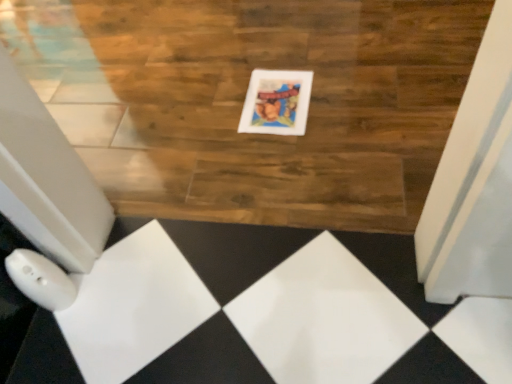
Image resolution: width=512 pixels, height=384 pixels. What do you see at coordinates (244, 99) in the screenshot?
I see `wooden floor at center` at bounding box center [244, 99].

At what (x,y) coordinates should I click in order to perform the action: click on wooden floor at center. Please return your answer as a coordinate pair (x, y). The height and width of the screenshot is (384, 512). Looking at the image, I should click on (244, 99).

The width and height of the screenshot is (512, 384). What do you see at coordinates (276, 102) in the screenshot?
I see `white glossy picture frame at center` at bounding box center [276, 102].

Measure the distance between white glossy picture frame at center and camera.

white glossy picture frame at center and camera are 1.33 meters apart from each other.

Identify the location of white glossy picture frame at center. (276, 102).

This screenshot has height=384, width=512. What are the coordinates of `wooden floor at center` in the screenshot? It's located at (244, 99).

Is wooden floor at center at the left side of white glossy picture frame at center?

Indeed, wooden floor at center is positioned on the left side of white glossy picture frame at center.

Is wooden floor at center closer to camera compared to white glossy picture frame at center?

Yes, wooden floor at center is in front of white glossy picture frame at center.

Is point (69, 76) positioned after point (258, 97)?

Yes, point (69, 76) is farther from viewer.

From the image's perspective, would you say wooden floor at center is positioned over white glossy picture frame at center?

Correct, wooden floor at center appears higher than white glossy picture frame at center in the image.

From a real-world perspective, between wooden floor at center and white glossy picture frame at center, who is vertically lower?

wooden floor at center, from a real-world perspective.

Does wooden floor at center have a lesser width compared to white glossy picture frame at center?

In fact, wooden floor at center might be wider than white glossy picture frame at center.

Can you confirm if wooden floor at center is shorter than white glossy picture frame at center?

Incorrect, the height of wooden floor at center does not fall short of that of white glossy picture frame at center.

Is wooden floor at center bigger than white glossy picture frame at center?

Indeed, wooden floor at center has a larger size compared to white glossy picture frame at center.

Choose the correct answer: Is wooden floor at center inside white glossy picture frame at center or outside it?

wooden floor at center exists outside the volume of white glossy picture frame at center.

Does wooden floor at center touch white glossy picture frame at center?

No, wooden floor at center is not touching white glossy picture frame at center.

Is wooden floor at center looking in the opposite direction of white glossy picture frame at center?

Absolutely, wooden floor at center is directed away from white glossy picture frame at center.

How many degrees apart are the facing directions of wooden floor at center and white glossy picture frame at center?

There is a 0.000261-degree angle between the facing directions of wooden floor at center and white glossy picture frame at center.

Locate an element on the screen. The width and height of the screenshot is (512, 384). hardwood in front of the white glossy picture frame at center is located at coordinates (244, 99).

Does white glossy picture frame at center appear on the left side of wooden floor at center?

Incorrect, white glossy picture frame at center is not on the left side of wooden floor at center.

Is white glossy picture frame at center in front of or behind wooden floor at center in the image?

Visually, white glossy picture frame at center is located behind wooden floor at center.

Is point (303, 74) less distant than point (114, 145)?

That is False.

From the image's perspective, is white glossy picture frame at center above wooden floor at center?

No, from the image's perspective, white glossy picture frame at center is not on top of wooden floor at center.

From a real-world perspective, which is physically below, white glossy picture frame at center or wooden floor at center?

wooden floor at center.

Which of these two, white glossy picture frame at center or wooden floor at center, is wider?

wooden floor at center.

Looking at this image, from their relative heights in the image, would you say white glossy picture frame at center is taller or shorter than wooden floor at center?

In the image, white glossy picture frame at center appears to be shorter than wooden floor at center.

Between white glossy picture frame at center and wooden floor at center, which one has larger size?

Bigger between the two is wooden floor at center.

Would you say white glossy picture frame at center is inside or outside wooden floor at center?

white glossy picture frame at center fits inside wooden floor at center.

Is white glossy picture frame at center not near wooden floor at center?

No, there isn't a large distance between white glossy picture frame at center and wooden floor at center.

Is wooden floor at center at the back of white glossy picture frame at center?

Correct, white glossy picture frame at center is looking away from wooden floor at center.

How distant is white glossy picture frame at center from wooden floor at center?

A distance of 12.60 inches exists between white glossy picture frame at center and wooden floor at center.

Where is `picture frame behind the wooden floor at center`? picture frame behind the wooden floor at center is located at coordinates (276, 102).

Locate an element on the screen. Image resolution: width=512 pixels, height=384 pixels. picture frame located below the wooden floor at center (from the image's perspective) is located at coordinates (276, 102).

The width and height of the screenshot is (512, 384). I want to click on hardwood on the left of white glossy picture frame at center, so click(244, 99).